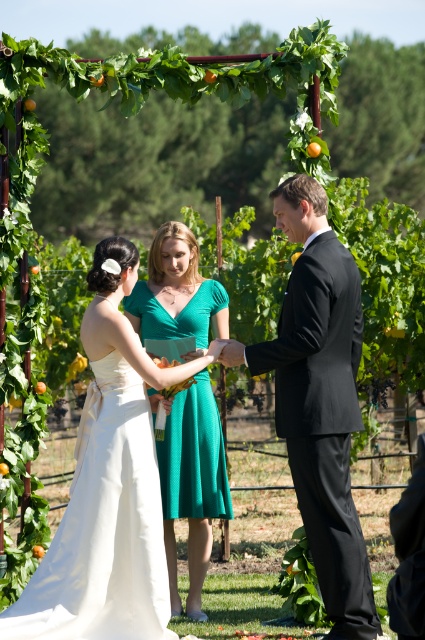
You are a photographer at the wedding ceremony. You want to take a photo that includes both the point at (70, 563) and the point at (172, 456). Which point should you focus on first to ensure both are in sharp focus?

You should focus on point (70, 563) first because it is closer to the camera than point (172, 456). This ensures the closer point is in focus, and the farther point will also be sharp due to depth of field.

You are a photographer at the wedding ceremony. You need to place a small bouquet of flowers at the point with coordinates point (x=108, y=484). Based on the scene description, where exactly should you place the bouquet?

The point (x=108, y=484) is on the satin white dress at center, so you should place the bouquet on the satin white dress at center.